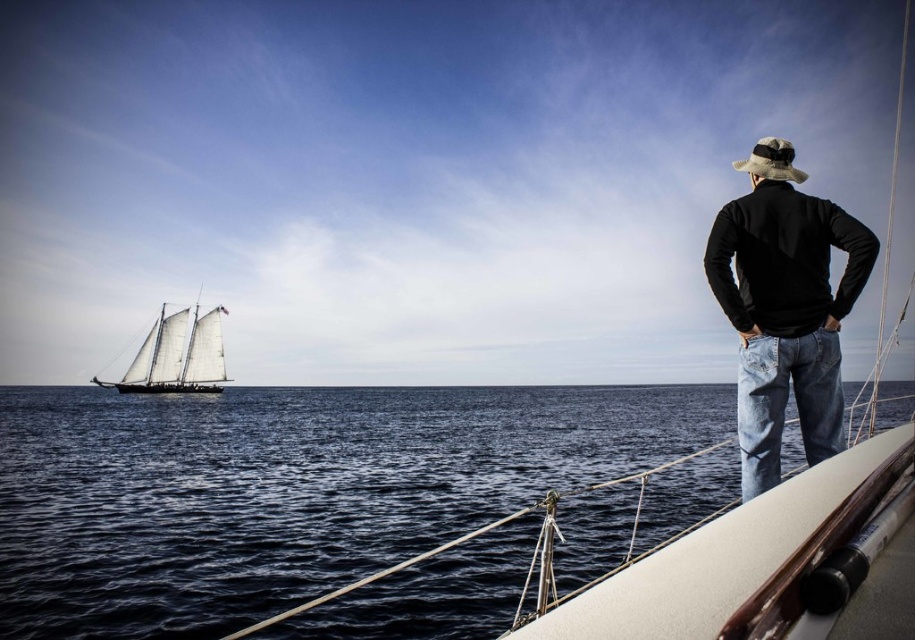
Question: Is black matte jacket at upper right positioned before white canvas sailboat at left?

Choices:
 (A) no
 (B) yes

Answer: (B)

Question: Can you confirm if dark blue water at center is positioned to the right of black matte jacket at upper right?

Choices:
 (A) no
 (B) yes

Answer: (A)

Question: Which of the following is the closest to the observer?

Choices:
 (A) black matte jacket at upper right
 (B) dark blue water at center
 (C) white canvas sailboat at left

Answer: (A)

Question: Estimate the real-world distances between objects in this image. Which object is closer to the black matte jacket at upper right?

Choices:
 (A) dark blue water at center
 (B) white canvas sailboat at left

Answer: (A)

Question: Can you confirm if dark blue water at center is thinner than black matte jacket at upper right?

Choices:
 (A) no
 (B) yes

Answer: (A)

Question: Which point is closer to the camera?

Choices:
 (A) (238, 477)
 (B) (160, 326)
 (C) (804, 275)

Answer: (C)